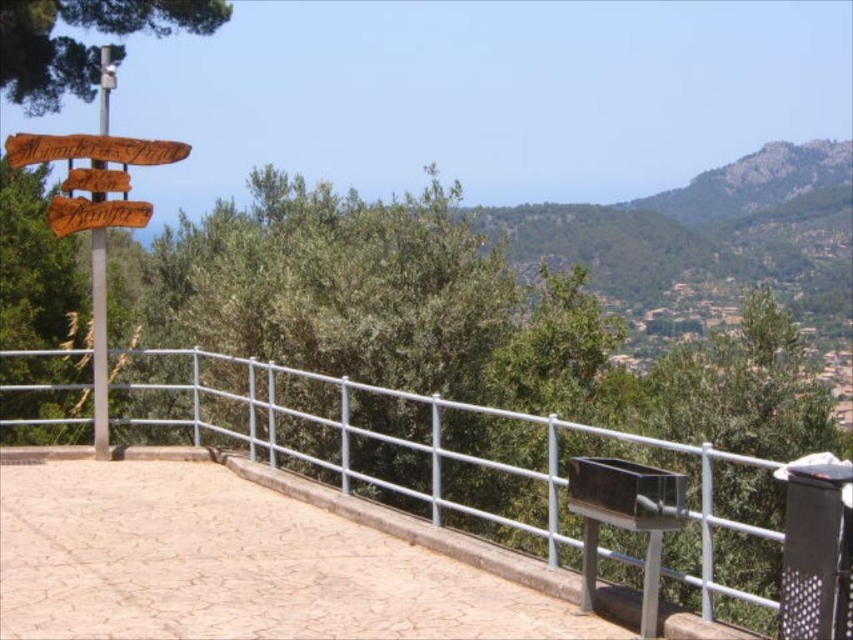
Question: Can you confirm if brown textured stone at center is wider than silver metallic fence at center?

Choices:
 (A) yes
 (B) no

Answer: (B)

Question: Is brown textured stone at center behind wooden sign at upper left?

Choices:
 (A) yes
 (B) no

Answer: (B)

Question: Which point is closer to the camera?

Choices:
 (A) (97, 394)
 (B) (49, 147)

Answer: (B)

Question: Can you confirm if silver metallic fence at center is positioned above green leafy tree at upper left?

Choices:
 (A) yes
 (B) no

Answer: (B)

Question: Which object appears closest to the camera in this image?

Choices:
 (A) silver metallic fence at center
 (B) green leafy tree at upper left
 (C) wooden sign at upper left

Answer: (A)

Question: Which object is farther from the camera taking this photo?

Choices:
 (A) brown textured stone at center
 (B) wooden sign at upper left
 (C) green leafy tree at upper left

Answer: (C)